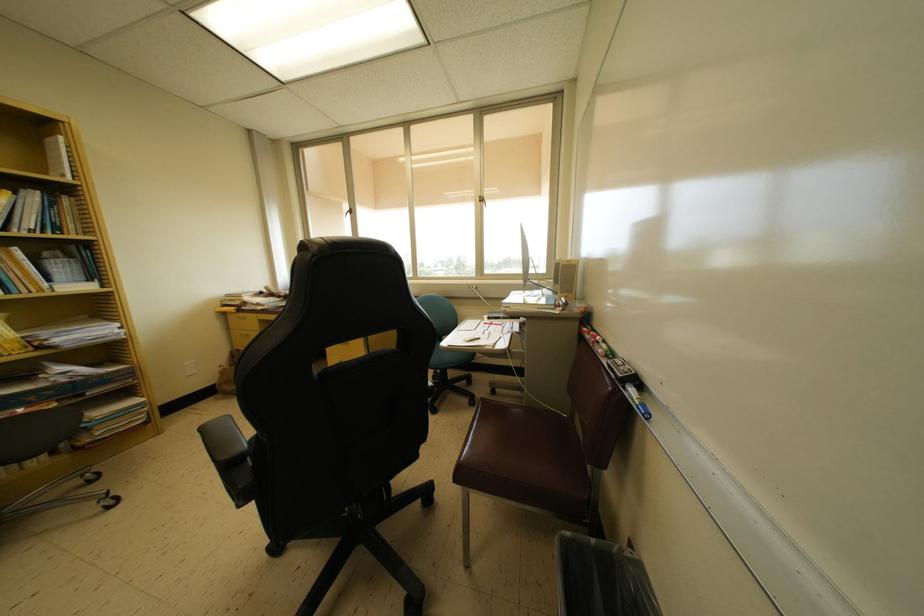
Where is `small computer speaker`? small computer speaker is located at coordinates (565, 281).